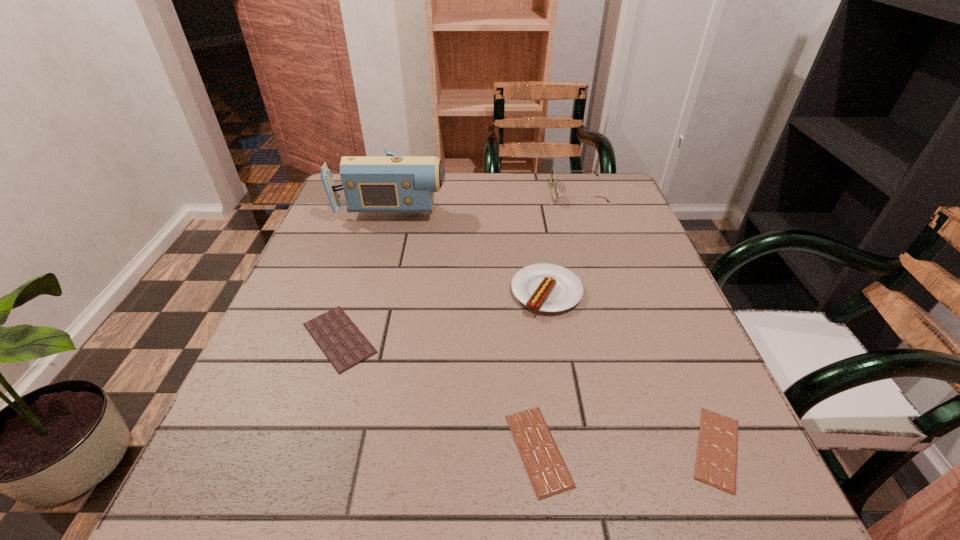
Locate an element on the screen. The image size is (960, 540). chocolate bar that is at the right edge is located at coordinates (716, 462).

I want to click on object present at the far left corner, so click(393, 183).

You are a GUI agent. You are given a task and a screenshot of the screen. Output one action in this format:
    pyautogui.click(x=<x>, y=<y>)
    Task: Click on the object at the far right corner
    The height and width of the screenshot is (540, 960).
    Given the screenshot: What is the action you would take?
    pyautogui.click(x=552, y=171)

The image size is (960, 540). I want to click on object at the near right corner, so click(716, 462).

This screenshot has width=960, height=540. In the image, there is a desktop. What are the coordinates of `vacant space at the far edge` in the screenshot? It's located at (523, 174).

At what (x,y) coordinates should I click in order to perform the action: click on vacant space at the near edge. Please return your answer as a coordinate pair (x, y). The height and width of the screenshot is (540, 960). Looking at the image, I should click on (352, 476).

Locate an element on the screen. Image resolution: width=960 pixels, height=540 pixels. vacant area at the left edge is located at coordinates (270, 390).

Find the location of `vacant space at the right edge of the desktop`. vacant space at the right edge of the desktop is located at coordinates point(621,240).

The image size is (960, 540). I want to click on free space at the far left corner, so click(344, 205).

Image resolution: width=960 pixels, height=540 pixels. In order to click on free region at the far right corner of the desktop in this screenshot , I will do `click(607, 218)`.